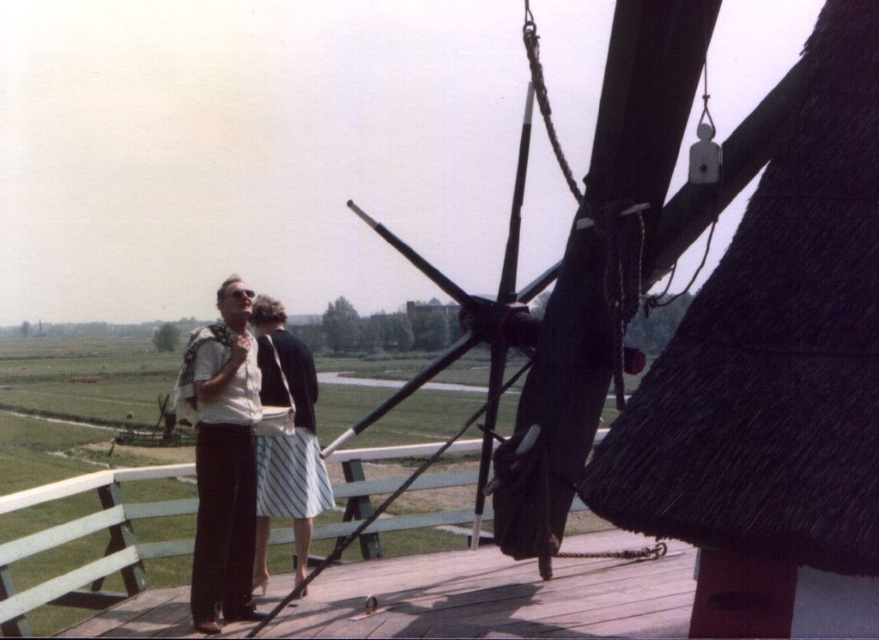
Question: Does white cotton dress at center have a greater width compared to striped cotton skirt at center?

Choices:
 (A) no
 (B) yes

Answer: (B)

Question: Which of these objects is positioned closest to the striped cotton skirt at center?

Choices:
 (A) white cotton dress at center
 (B) wooden at center

Answer: (A)

Question: Does wooden at center appear under white cotton dress at center?

Choices:
 (A) no
 (B) yes

Answer: (B)

Question: Which object appears farthest from the camera in this image?

Choices:
 (A) white cotton dress at center
 (B) wooden at center
 (C) striped cotton skirt at center

Answer: (C)

Question: Estimate the real-world distances between objects in this image. Which object is closer to the wooden at center?

Choices:
 (A) striped cotton skirt at center
 (B) white cotton dress at center

Answer: (A)

Question: Does white cotton dress at center have a smaller size compared to striped cotton skirt at center?

Choices:
 (A) no
 (B) yes

Answer: (B)